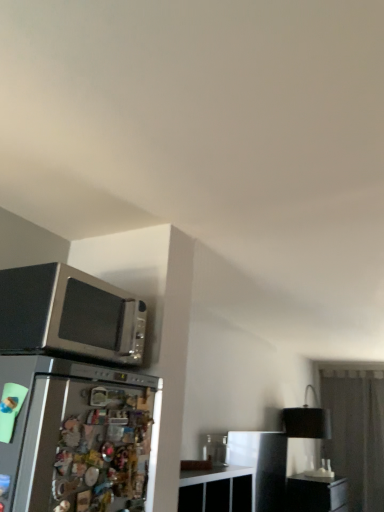
Question: Does black matte file cabinet at lower right have a lesser height compared to transparent glass door at right?

Choices:
 (A) no
 (B) yes

Answer: (B)

Question: Can you confirm if black matte file cabinet at lower right is wider than transparent glass door at right?

Choices:
 (A) yes
 (B) no

Answer: (A)

Question: Is black matte file cabinet at lower right to the right of transparent glass door at right from the viewer's perspective?

Choices:
 (A) no
 (B) yes

Answer: (A)

Question: Does black matte file cabinet at lower right have a larger size compared to transparent glass door at right?

Choices:
 (A) yes
 (B) no

Answer: (B)

Question: Is transparent glass door at right located within black matte file cabinet at lower right?

Choices:
 (A) yes
 (B) no

Answer: (B)

Question: Is black matte file cabinet at lower right far from transparent glass door at right?

Choices:
 (A) yes
 (B) no

Answer: (B)

Question: Does satin black microwave at upper left come behind black matte file cabinet at lower right?

Choices:
 (A) yes
 (B) no

Answer: (B)

Question: Can you confirm if satin black microwave at upper left is taller than black matte file cabinet at lower right?

Choices:
 (A) yes
 (B) no

Answer: (B)

Question: From the image's perspective, would you say satin black microwave at upper left is positioned over black matte file cabinet at lower right?

Choices:
 (A) yes
 (B) no

Answer: (A)

Question: Is satin black microwave at upper left positioned in front of black matte file cabinet at lower right?

Choices:
 (A) yes
 (B) no

Answer: (A)

Question: Is black matte file cabinet at lower right completely or partially inside satin black microwave at upper left?

Choices:
 (A) no
 (B) yes

Answer: (A)

Question: Is satin black microwave at upper left turned away from black matte file cabinet at lower right?

Choices:
 (A) yes
 (B) no

Answer: (B)

Question: Are transparent glass door at right and satin black microwave at upper left located far from each other?

Choices:
 (A) no
 (B) yes

Answer: (B)